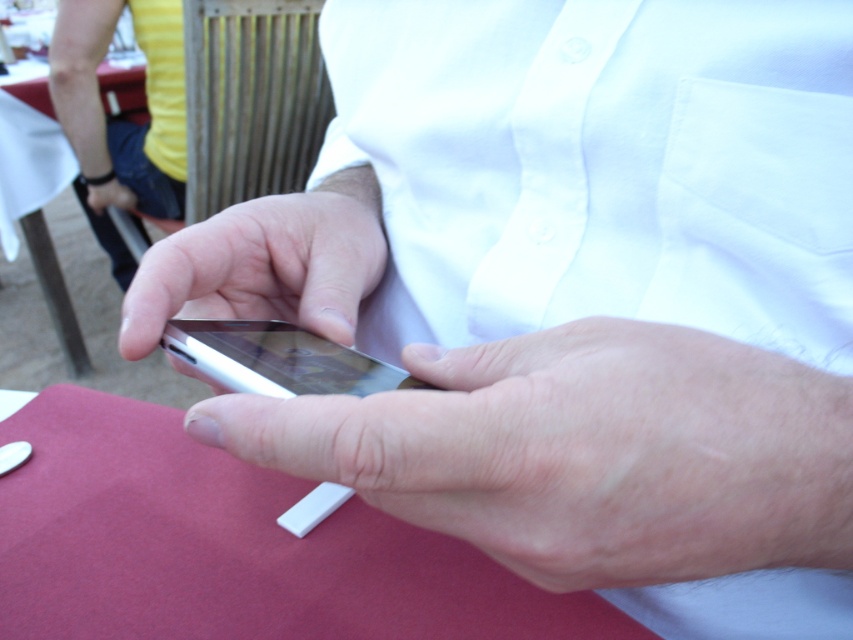
You are looking at the image and notice two points marked at coordinates point (224, 212) and point (177, 337). Which point is closer to you?

Point (224, 212) is further to the viewer than point (177, 337), so the point closer to you is point (177, 337).

You are a photographer setting up a shoot. You have two red items in the scene, the smooth red cloth at lower center and the smooth red table at lower left. Which item is placed directly below the other?

The smooth red cloth at lower center is positioned under the smooth red table at lower left, so the cloth is below the table.